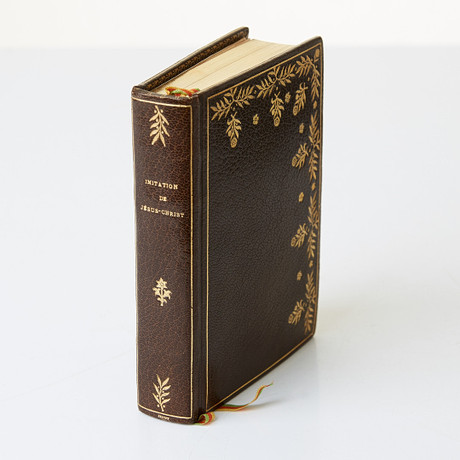
Where is `bottom right corner of the book`? The width and height of the screenshot is (460, 460). bottom right corner of the book is located at coordinates (311, 333).